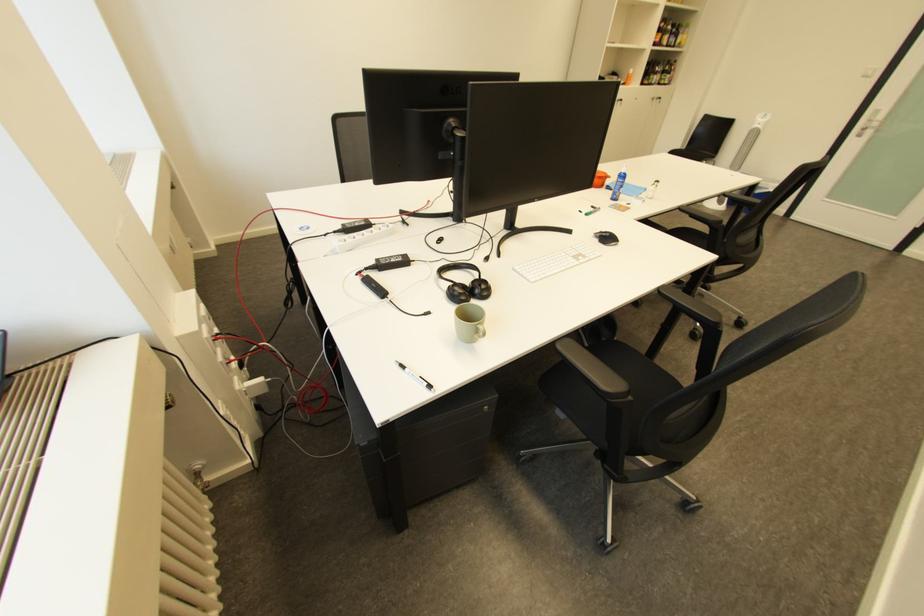
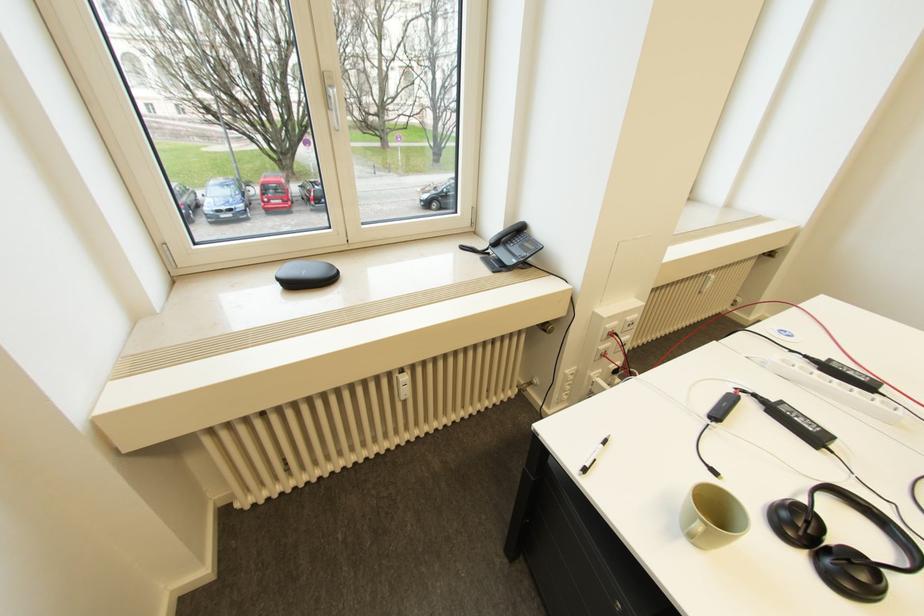
In the second image, find the point that corresponds to the point at 494,294 in the first image.

(857, 586)